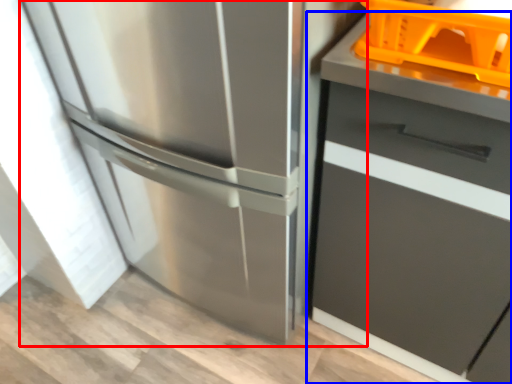
Question: Which of the following is the closest to the observer, refrigerator (highlighted by a red box) or cabinetry (highlighted by a blue box)?

Choices:
 (A) refrigerator
 (B) cabinetry

Answer: (B)